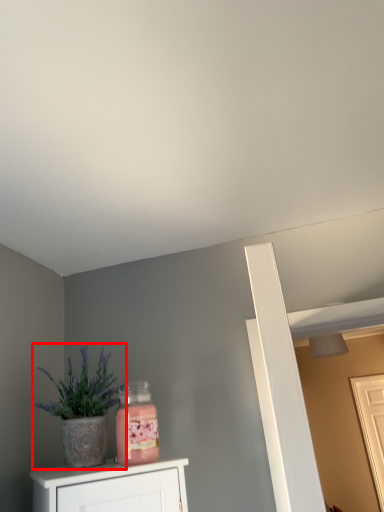
Question: From the image's perspective, considering the relative positions of houseplant (annotated by the red box) and door in the image provided, where is houseplant (annotated by the red box) located with respect to the staircase?

Choices:
 (A) below
 (B) above

Answer: (B)